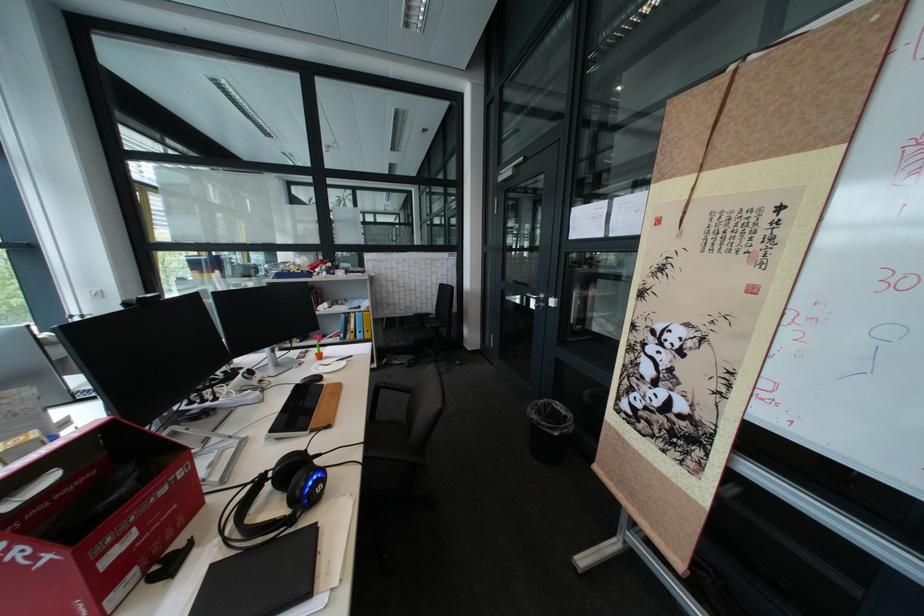
Find the location of `black chair sitting surface`. black chair sitting surface is located at coordinates (388, 431).